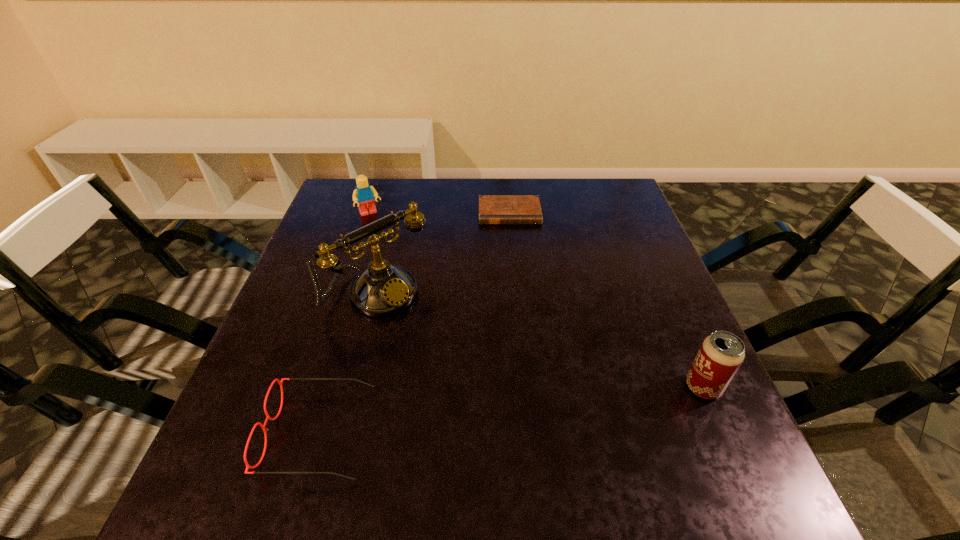
Locate an element on the screen. spectacles is located at coordinates (248, 466).

Find the location of `beer can`. beer can is located at coordinates (722, 353).

Find the location of a particular element. telephone is located at coordinates (383, 289).

Where is `the third farthest object`? Image resolution: width=960 pixels, height=540 pixels. the third farthest object is located at coordinates pos(383,289).

At what (x,y) coordinates should I click in order to perform the action: click on the second object from right to left. Please return your answer as a coordinate pair (x, y). The height and width of the screenshot is (540, 960). Looking at the image, I should click on (493, 209).

Where is `the shortest object`? The width and height of the screenshot is (960, 540). the shortest object is located at coordinates (493, 209).

Where is `Lego`? This screenshot has height=540, width=960. Lego is located at coordinates (363, 195).

Identify the location of free location located on the front-facing side of the spectacles. The width and height of the screenshot is (960, 540). (225, 433).

The width and height of the screenshot is (960, 540). What are the coordinates of `vacant space located 0.250m on the back of the rightmost object` in the screenshot? It's located at (659, 285).

Where is `free space located 0.360m on the dial of the telephone`? This screenshot has width=960, height=540. free space located 0.360m on the dial of the telephone is located at coordinates pos(531,428).